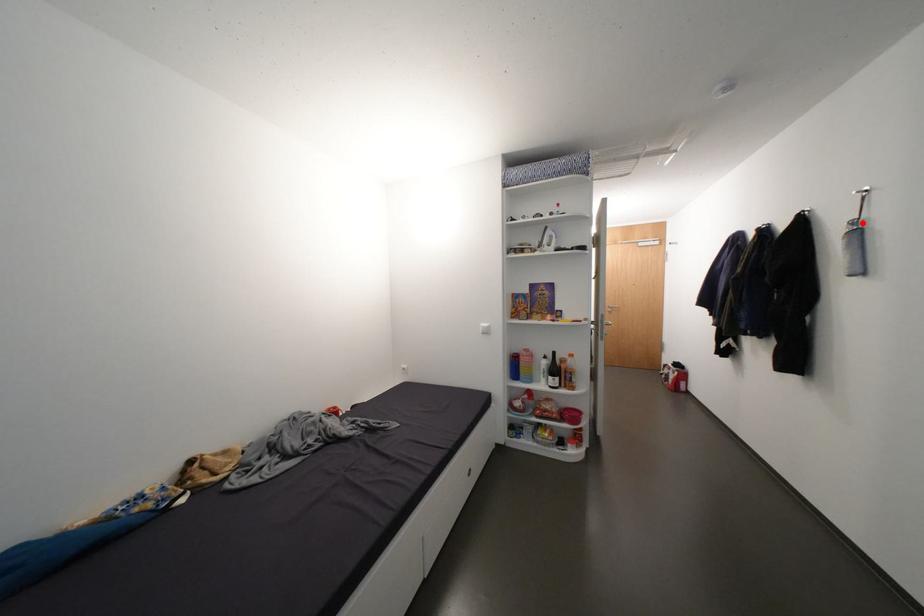
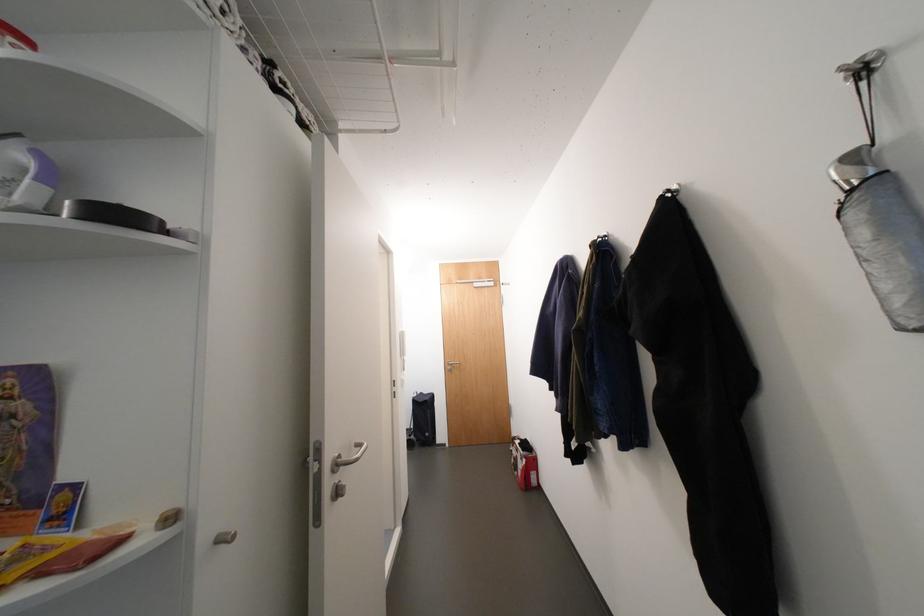
The point at the highlighted location is marked in the first image. Where is the corresponding point in the second image?

(864, 159)